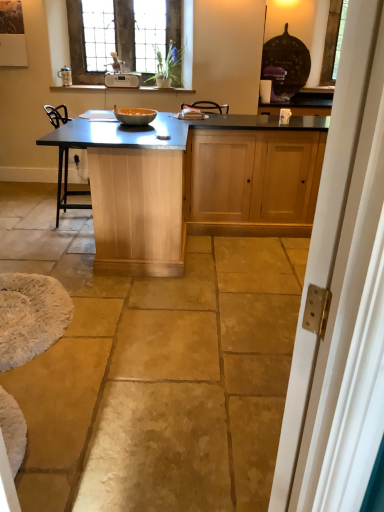
I want to click on wooden cabinet at center, so click(252, 181).

Measure the distance between point (263, 170) and camera.

3.44 meters.

The image size is (384, 512). What do you see at coordinates (30, 316) in the screenshot?
I see `white fluffy rug at lower left` at bounding box center [30, 316].

What is the approximate width of white fluffy rug at lower left?

white fluffy rug at lower left is 23.80 inches in width.

At what (x,y) coordinates should I click in order to perform the action: click on wooden cabinet at center. Please return your answer as a coordinate pair (x, y). The height and width of the screenshot is (512, 384). Looking at the image, I should click on (252, 181).

From the image's perspective, between white plastic toaster at upper center and matte orange bowl at center, who is located below?

From the image's view, matte orange bowl at center is below.

Considering the relative positions of white plastic toaster at upper center and matte orange bowl at center in the image provided, is white plastic toaster at upper center behind matte orange bowl at center?

Yes, white plastic toaster at upper center is further from the viewer.

Between white plastic toaster at upper center and matte orange bowl at center, which one has less height?

matte orange bowl at center.

From the picture: Is white plastic toaster at upper center aimed at matte orange bowl at center?

Yes.

From a real-world perspective, who is located lower, stained glass window at upper center or matte orange bowl at center?

matte orange bowl at center, from a real-world perspective.

Identify the location of window above the matte orange bowl at center (from the image's perspective). (79, 47).

Does point (177, 38) appear closer or farther from the camera than point (143, 108)?

Point (177, 38) appears to be farther away from the viewer than point (143, 108).

Is stained glass window at upper center to the right of matte orange bowl at center from the viewer's perspective?

No.

Does point (24, 330) lie behind point (116, 113)?

No, (24, 330) is in front of (116, 113).

Would you say white fluffy rug at lower left is inside or outside matte orange bowl at center?

white fluffy rug at lower left is outside matte orange bowl at center.

Find the location of a particular element. Image resolution: width=384 pixels, height=512 pixels. bowl on the right of white fluffy rug at lower left is located at coordinates (135, 116).

From the image's perspective, is white fluffy rug at lower left under matte orange bowl at center?

Indeed, from the image's perspective, white fluffy rug at lower left is shown beneath matte orange bowl at center.

Considering the relative sizes of matte orange bowl at center and matte wood table at center in the image provided, is matte orange bowl at center taller than matte wood table at center?

Incorrect, the height of matte orange bowl at center is not larger of that of matte wood table at center.

Is matte orange bowl at center at the right side of matte wood table at center?

Correct, you'll find matte orange bowl at center to the right of matte wood table at center.

This screenshot has width=384, height=512. What are the coordinates of `kitchen & dining room table in front of the matte orange bowl at center` in the screenshot? It's located at coord(183,185).

Could you tell me if matte orange bowl at center is turned towards matte wood table at center?

No, matte orange bowl at center is not facing towards matte wood table at center.

Is matte wood table at center facing away from matte orange bowl at center?

matte wood table at center is not turned away from matte orange bowl at center.

From a real-world perspective, is matte wood table at center positioned over matte orange bowl at center based on gravity?

No.

Is matte wood table at center to the left of matte orange bowl at center from the viewer's perspective?

Yes.

Which of these two, matte wood table at center or matte orange bowl at center, is smaller?

matte orange bowl at center.

From the image's perspective, does white wood screen door at right appear higher than stained glass window at upper center?

No.

Is the depth of white wood screen door at right greater than that of stained glass window at upper center?

No, it is not.

I want to click on window that appears behind the white wood screen door at right, so (79, 47).

Is white wood screen door at right directly adjacent to stained glass window at upper center?

No, white wood screen door at right is not making contact with stained glass window at upper center.

Is matte wood table at center oriented towards white wood screen door at right?

No, matte wood table at center does not turn towards white wood screen door at right.

Between matte wood table at center and white wood screen door at right, which one is positioned in front?

white wood screen door at right is more forward.

I want to click on screen door on the right of matte wood table at center, so click(342, 295).

Consider the image. Measure the distance between matte wood table at center and white wood screen door at right.

matte wood table at center is 2.15 meters away from white wood screen door at right.

The image size is (384, 512). What are the coordinates of `bowl below the white plastic toaster at upper center (from the image's perspective)` in the screenshot? It's located at (135, 116).

At what (x,y) coordinates should I click in order to perform the action: click on window that appears above the matte orange bowl at center (from a real-world perspective). Please return your answer as a coordinate pair (x, y). The image size is (384, 512). Looking at the image, I should click on (79, 47).

Based on their spatial positions, is matte wood table at center or stained glass window at upper center further from white fluffy rug at lower left?

stained glass window at upper center is further to white fluffy rug at lower left.

In the scene shown: Looking at the image, which one is located closer to wooden cabinet at center, white wood screen door at right or white plastic toaster at upper center?

white plastic toaster at upper center lies closer to wooden cabinet at center than the other object.

From the image, which object appears to be farther from white wood screen door at right, matte wood table at center or wooden cabinet at center?

wooden cabinet at center is further to white wood screen door at right.

Considering their positions, is white plastic toaster at upper center positioned further to matte wood table at center than matte orange bowl at center?

white plastic toaster at upper center is positioned further to the anchor matte wood table at center.

Consider the image. Based on their spatial positions, is wooden cabinet at center or stained glass window at upper center closer to matte wood table at center?

The object closer to matte wood table at center is wooden cabinet at center.

Estimate the real-world distances between objects in this image. Which object is further from stained glass window at upper center, wooden cabinet at center or white wood screen door at right?

white wood screen door at right lies further to stained glass window at upper center than the other object.

Estimate the real-world distances between objects in this image. Which object is further from matte orange bowl at center, wooden cabinet at center or white fluffy rug at lower left?

Among the two, white fluffy rug at lower left is located further to matte orange bowl at center.

Consider the image. Considering their positions, is white wood screen door at right positioned closer to wooden cabinet at center than stained glass window at upper center?

A: stained glass window at upper center is positioned closer to the anchor wooden cabinet at center.

At what (x,y) coordinates should I click in order to perform the action: click on kitchen & dining room table located between white wood screen door at right and white plastic toaster at upper center in the depth direction. Please return your answer as a coordinate pair (x, y). The height and width of the screenshot is (512, 384). Looking at the image, I should click on (183, 185).

Identify the location of kitchen & dining room table positioned between white fluffy rug at lower left and white plastic toaster at upper center from near to far. (183, 185).

This screenshot has height=512, width=384. Find the location of `bowl between white fluffy rug at lower left and wooden cabinet at center in the horizontal direction`. bowl between white fluffy rug at lower left and wooden cabinet at center in the horizontal direction is located at coordinates (135, 116).

This screenshot has width=384, height=512. I want to click on wide positioned between white wood screen door at right and white plastic toaster at upper center from near to far, so pyautogui.click(x=30, y=316).